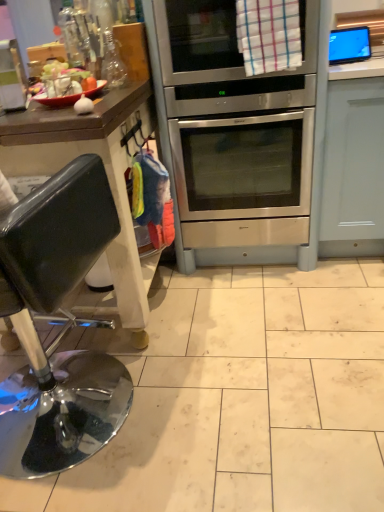
Question: Is stainless steel oven at center taller or shorter than matte glass bowl at upper left?

Choices:
 (A) tall
 (B) short

Answer: (A)

Question: In the image, is stainless steel oven at center positioned in front of or behind matte glass bowl at upper left?

Choices:
 (A) behind
 (B) front

Answer: (A)

Question: Estimate the real-world distances between objects in this image. Which object is farther from the stainless steel oven at center?

Choices:
 (A) matte glass bowl at upper left
 (B) shiny black stool at left
 (C) flat screen tv at upper right

Answer: (B)

Question: Which object is positioned closest to the stainless steel oven at center?

Choices:
 (A) matte glass bowl at upper left
 (B) flat screen tv at upper right
 (C) shiny black stool at left

Answer: (B)